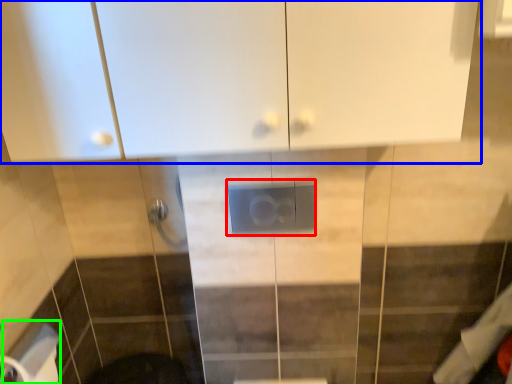
Question: Based on their relative distances, which object is nearer to electric outlet (highlighted by a red box)? Choose from cabinetry (highlighted by a blue box) and toilet paper (highlighted by a green box).

Choices:
 (A) cabinetry
 (B) toilet paper

Answer: (A)